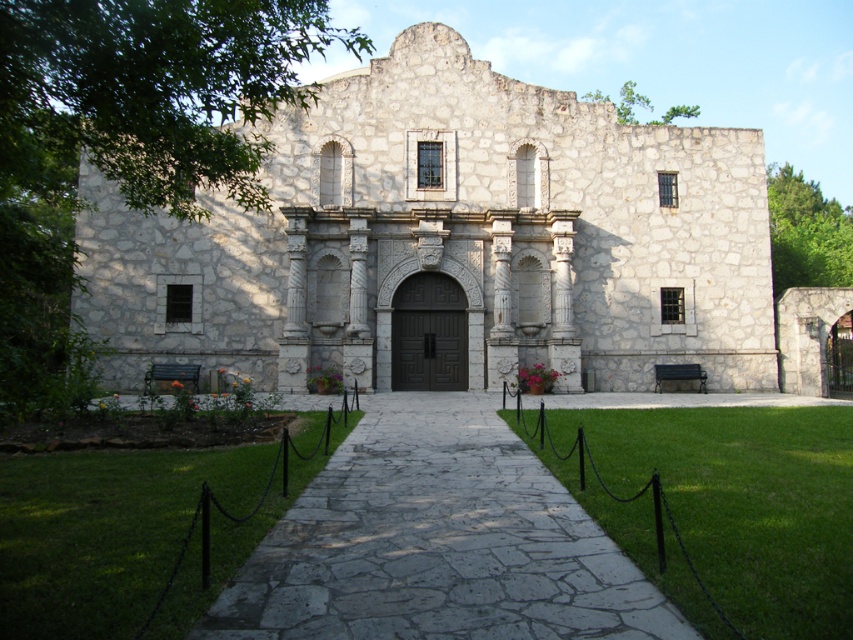
Can you confirm if gray stone pathway at center is positioned to the right of dark brown wood door at center?

Incorrect, gray stone pathway at center is not on the right side of dark brown wood door at center.

Can you confirm if gray stone pathway at center is taller than dark brown wood door at center?

No.

Does point (409, 481) come closer to viewer compared to point (431, 292)?

Yes, point (409, 481) is in front of point (431, 292).

This screenshot has width=853, height=640. I want to click on gray stone pathway at center, so click(437, 541).

Between stone textured church at center and gray stone pathway at center, which one appears on the left side from the viewer's perspective?

stone textured church at center

Between stone textured church at center and gray stone pathway at center, which one is positioned higher?

stone textured church at center is higher up.

Which is in front, point (555, 285) or point (309, 490)?

Point (309, 490)

Find the location of a particular element. The width and height of the screenshot is (853, 640). stone textured church at center is located at coordinates (451, 240).

Between stone textured church at center and dark brown wood door at center, which one has more height?

stone textured church at center is taller.

Is stone textured church at center above dark brown wood door at center?

Correct, stone textured church at center is located above dark brown wood door at center.

Find the location of a particular element. The height and width of the screenshot is (640, 853). stone textured church at center is located at coordinates (451, 240).